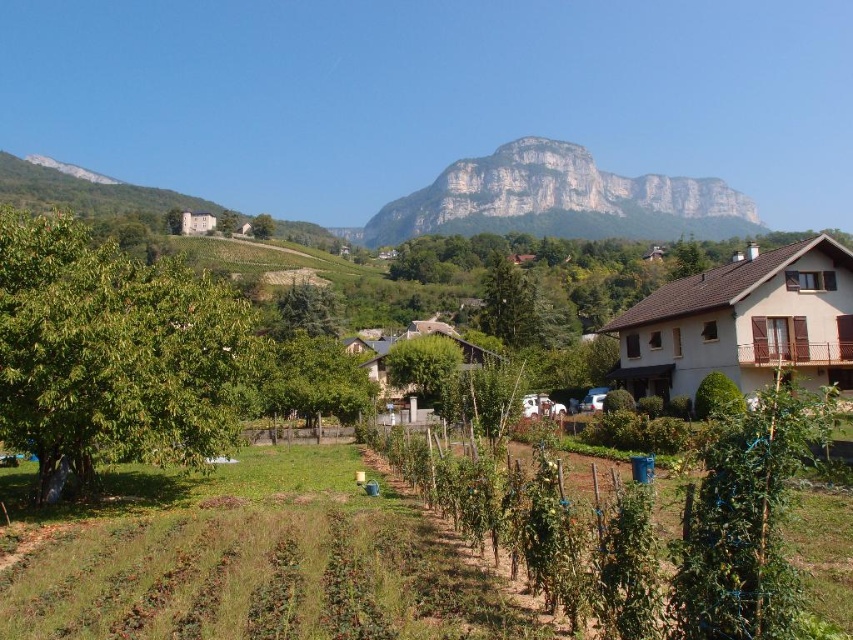
Question: Which object is positioned farthest from the rugged stone mountain at upper center?

Choices:
 (A) green leafy tree at center
 (B) green leafy tree at left
 (C) green leafy tree at upper center

Answer: (B)

Question: Which object appears farthest from the camera in this image?

Choices:
 (A) rugged stone mountain at upper center
 (B) green leafy tree at center
 (C) green leafy tree at upper center
 (D) green leafy tree at left

Answer: (A)

Question: Is green leafy tree at left positioned at the back of green leafy tree at center?

Choices:
 (A) no
 (B) yes

Answer: (A)

Question: Does green leafy tree at left lie behind green leafy tree at center?

Choices:
 (A) yes
 (B) no

Answer: (B)

Question: Which object appears farthest from the camera in this image?

Choices:
 (A) green leafy tree at upper center
 (B) green leafy tree at left

Answer: (A)

Question: From the image, what is the correct spatial relationship of green leafy tree at left in relation to rugged stone mountain at upper center?

Choices:
 (A) left
 (B) right

Answer: (A)